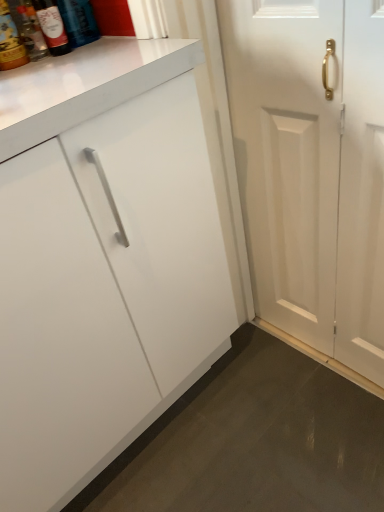
How much space does matte glass bottle at upper left, which is the 1th bottle in left-to-right order, occupy vertically?

The height of matte glass bottle at upper left, which is the 1th bottle in left-to-right order, is 8.98 inches.

Where is `white wooden door at right`? This screenshot has width=384, height=512. white wooden door at right is located at coordinates (312, 167).

What do you see at coordinates (78, 21) in the screenshot? This screenshot has height=512, width=384. I see `matte glass bottle at upper left, which ranks as the 4th bottle in left-to-right order` at bounding box center [78, 21].

The image size is (384, 512). In order to click on matte glass bottle at upper left, which is the 1th bottle in left-to-right order in this screenshot , I will do `click(10, 41)`.

Considering the relative sizes of matte glass bottle at upper left, arranged as the 2th bottle when viewed from the left, and matte glass bottle at upper left, which is the third bottle from left to right, in the image provided, is matte glass bottle at upper left, arranged as the 2th bottle when viewed from the left, thinner than matte glass bottle at upper left, which is the third bottle from left to right,?

Incorrect, the width of matte glass bottle at upper left, arranged as the 2th bottle when viewed from the left, is not less than that of matte glass bottle at upper left, which is the third bottle from left to right.

Is matte glass bottle at upper left, the 3th bottle positioned from the right, positioned beyond the bounds of matte glass bottle at upper left, which is the third bottle from left to right?

That's correct, matte glass bottle at upper left, the 3th bottle positioned from the right, is outside of matte glass bottle at upper left, which is the third bottle from left to right.

From a real-world perspective, which object rests below the other?

matte glass bottle at upper left, the 3th bottle positioned from the right, from a real-world perspective.

Which is closer to the camera, (67, 25) or (49, 9)?

Point (67, 25) appears to be farther away from the viewer than point (49, 9).

Which bottle is the 4th one when counting from the back of the white wooden door at right? Please provide its 2D coordinates.

[(64, 24)]

Is white wooden door at right next to matte glass bottle at upper left, the 3th bottle positioned from the right, and touching it?

white wooden door at right and matte glass bottle at upper left, the 3th bottle positioned from the right, are clearly separated.

How different are the orientations of white wooden door at right and matte glass bottle at upper left, arranged as the 2th bottle when viewed from the left, in degrees?

They differ by 90 degrees in their facing directions.

Considering the relative sizes of white wooden door at right and matte glass bottle at upper left, the 3th bottle positioned from the right, in the image provided, is white wooden door at right thinner than matte glass bottle at upper left, the 3th bottle positioned from the right,?

Yes, white wooden door at right is thinner than matte glass bottle at upper left, the 3th bottle positioned from the right.

From a real-world perspective, which object stands above the other?

matte glass bottle at upper left, which is the 1th bottle in left-to-right order, from a real-world perspective.

Which is nearer, (59,14) or (14,32)?

The point (59,14) is closer to the camera.

Is matte glass bottle at upper left, which is the third bottle from left to right, located outside matte glass bottle at upper left, which is the 1th bottle in left-to-right order?

That's correct, matte glass bottle at upper left, which is the third bottle from left to right, is outside of matte glass bottle at upper left, which is the 1th bottle in left-to-right order.

From the image's perspective, which is below, matte glass bottle at upper left, placed as the fourth bottle when sorted from right to left, or matte glass bottle at upper left, arranged as the 2th bottle when viewed from the left?

From the image's view, matte glass bottle at upper left, placed as the fourth bottle when sorted from right to left, is below.

From the picture: Is matte glass bottle at upper left, placed as the fourth bottle when sorted from right to left, to the left or to the right of matte glass bottle at upper left, arranged as the 2th bottle when viewed from the left, in the image?

Based on their positions, matte glass bottle at upper left, placed as the fourth bottle when sorted from right to left, is located to the left of matte glass bottle at upper left, arranged as the 2th bottle when viewed from the left.

From a real-world perspective, is matte glass bottle at upper left, which is the 1th bottle in left-to-right order, physically below matte glass bottle at upper left, arranged as the 2th bottle when viewed from the left?

No, from a real-world perspective, matte glass bottle at upper left, which is the 1th bottle in left-to-right order, is not under matte glass bottle at upper left, arranged as the 2th bottle when viewed from the left.

Is matte glass bottle at upper left, placed as the fourth bottle when sorted from right to left, further to camera compared to matte glass bottle at upper left, arranged as the 2th bottle when viewed from the left?

No, matte glass bottle at upper left, placed as the fourth bottle when sorted from right to left, is in front of matte glass bottle at upper left, arranged as the 2th bottle when viewed from the left.

What's the angular difference between matte glass bottle at upper left, placed as the fourth bottle when sorted from right to left, and matte glass bottle at upper left, which ranks as the 1th bottle in right-to-left order,'s facing directions?

There is a 0.00418-degree angle between the facing directions of matte glass bottle at upper left, placed as the fourth bottle when sorted from right to left, and matte glass bottle at upper left, which ranks as the 1th bottle in right-to-left order.

Does point (5, 3) come behind point (63, 11)?

Yes, point (5, 3) is behind point (63, 11).

Is matte glass bottle at upper left, placed as the fourth bottle when sorted from right to left, at the right side of matte glass bottle at upper left, which ranks as the 1th bottle in right-to-left order?

In fact, matte glass bottle at upper left, placed as the fourth bottle when sorted from right to left, is to the left of matte glass bottle at upper left, which ranks as the 1th bottle in right-to-left order.

From the image's perspective, does matte glass bottle at upper left, placed as the fourth bottle when sorted from right to left, appear higher than matte glass bottle at upper left, which ranks as the 1th bottle in right-to-left order?

Incorrect, from the image's perspective, matte glass bottle at upper left, placed as the fourth bottle when sorted from right to left, is lower than matte glass bottle at upper left, which ranks as the 1th bottle in right-to-left order.

Based on the photo, considering the relative positions of matte glass bottle at upper left, which ranks as the 1th bottle in right-to-left order, and matte glass bottle at upper left, placed as the fourth bottle when sorted from right to left, in the image provided, is matte glass bottle at upper left, which ranks as the 1th bottle in right-to-left order, behind matte glass bottle at upper left, placed as the fourth bottle when sorted from right to left,?

Yes, it is behind matte glass bottle at upper left, placed as the fourth bottle when sorted from right to left.

Does matte glass bottle at upper left, which ranks as the 4th bottle in left-to-right order, have a smaller size compared to matte glass bottle at upper left, placed as the fourth bottle when sorted from right to left?

Incorrect, matte glass bottle at upper left, which ranks as the 4th bottle in left-to-right order, is not smaller in size than matte glass bottle at upper left, placed as the fourth bottle when sorted from right to left.

Considering the relative sizes of matte glass bottle at upper left, which ranks as the 4th bottle in left-to-right order, and matte glass bottle at upper left, placed as the fourth bottle when sorted from right to left, in the image provided, is matte glass bottle at upper left, which ranks as the 4th bottle in left-to-right order, shorter than matte glass bottle at upper left, placed as the fourth bottle when sorted from right to left,?

In fact, matte glass bottle at upper left, which ranks as the 4th bottle in left-to-right order, may be taller than matte glass bottle at upper left, placed as the fourth bottle when sorted from right to left.

Based on the photo, how far apart are matte glass bottle at upper left, which ranks as the 1th bottle in right-to-left order, and matte glass bottle at upper left, which is the 1th bottle in left-to-right order?

matte glass bottle at upper left, which ranks as the 1th bottle in right-to-left order, is 5.05 inches from matte glass bottle at upper left, which is the 1th bottle in left-to-right order.

From the picture: Considering the relative sizes of matte glass bottle at upper left, the 3th bottle positioned from the right, and white wooden door at right in the image provided, is matte glass bottle at upper left, the 3th bottle positioned from the right, shorter than white wooden door at right?

Indeed, matte glass bottle at upper left, the 3th bottle positioned from the right, has a lesser height compared to white wooden door at right.

Is matte glass bottle at upper left, arranged as the 2th bottle when viewed from the left, looking in the opposite direction of white wooden door at right?

No, white wooden door at right is not at the back of matte glass bottle at upper left, arranged as the 2th bottle when viewed from the left.

From a real-world perspective, which is physically below, matte glass bottle at upper left, the 3th bottle positioned from the right, or white wooden door at right?

From a 3D spatial view, white wooden door at right is below.

At what (x,y) coordinates should I click in order to perform the action: click on the 1st bottle counting from the left side of the matte glass bottle at upper left, which appears as the second bottle when viewed from the right. Please return your answer as a coordinate pair (x, y). Looking at the image, I should click on (64, 24).

Locate an element on the screen. This screenshot has height=512, width=384. the 3rd bottle above the white wooden door at right (from the image's perspective) is located at coordinates (64, 24).

When comparing their distances from white wooden door at right, does matte glass bottle at upper left, which appears as the second bottle when viewed from the right, or matte glass bottle at upper left, which ranks as the 4th bottle in left-to-right order, seem further?

Among the two, matte glass bottle at upper left, which appears as the second bottle when viewed from the right, is located further to white wooden door at right.

Estimate the real-world distances between objects in this image. Which object is further from matte glass bottle at upper left, which is the 1th bottle in left-to-right order, matte glass bottle at upper left, which ranks as the 1th bottle in right-to-left order, or white wooden door at right?

white wooden door at right is further to matte glass bottle at upper left, which is the 1th bottle in left-to-right order.

When comparing their distances from matte glass bottle at upper left, arranged as the 2th bottle when viewed from the left, does matte glass bottle at upper left, which ranks as the 4th bottle in left-to-right order, or matte glass bottle at upper left, which appears as the second bottle when viewed from the right, seem further?

Among the two, matte glass bottle at upper left, which appears as the second bottle when viewed from the right, is located further to matte glass bottle at upper left, arranged as the 2th bottle when viewed from the left.

From the image, which object appears to be farther from matte glass bottle at upper left, placed as the fourth bottle when sorted from right to left, matte glass bottle at upper left, arranged as the 2th bottle when viewed from the left, or white wooden door at right?

Among the two, white wooden door at right is located further to matte glass bottle at upper left, placed as the fourth bottle when sorted from right to left.

From the image, which object appears to be farther from matte glass bottle at upper left, placed as the fourth bottle when sorted from right to left, matte glass bottle at upper left, which is the third bottle from left to right, or matte glass bottle at upper left, which ranks as the 1th bottle in right-to-left order?

matte glass bottle at upper left, which ranks as the 1th bottle in right-to-left order, is further to matte glass bottle at upper left, placed as the fourth bottle when sorted from right to left.

Looking at the image, which one is located further to matte glass bottle at upper left, which ranks as the 1th bottle in right-to-left order, matte glass bottle at upper left, the 3th bottle positioned from the right, or matte glass bottle at upper left, which is the third bottle from left to right?

Among the two, matte glass bottle at upper left, which is the third bottle from left to right, is located further to matte glass bottle at upper left, which ranks as the 1th bottle in right-to-left order.

Looking at the image, which one is located closer to matte glass bottle at upper left, placed as the fourth bottle when sorted from right to left, matte glass bottle at upper left, arranged as the 2th bottle when viewed from the left, or matte glass bottle at upper left, which appears as the second bottle when viewed from the right?

matte glass bottle at upper left, which appears as the second bottle when viewed from the right, lies closer to matte glass bottle at upper left, placed as the fourth bottle when sorted from right to left, than the other object.

Looking at the image, which one is located further to matte glass bottle at upper left, which appears as the second bottle when viewed from the right, matte glass bottle at upper left, arranged as the 2th bottle when viewed from the left, or matte glass bottle at upper left, which ranks as the 4th bottle in left-to-right order?

matte glass bottle at upper left, which ranks as the 4th bottle in left-to-right order, lies further to matte glass bottle at upper left, which appears as the second bottle when viewed from the right, than the other object.

I want to click on bottle situated between matte glass bottle at upper left, which is the third bottle from left to right, and white wooden door at right from left to right, so click(x=78, y=21).

I want to click on bottle between matte glass bottle at upper left, which ranks as the 1th bottle in right-to-left order, and matte glass bottle at upper left, which appears as the second bottle when viewed from the right, vertically, so click(64, 24).

You are a GUI agent. You are given a task and a screenshot of the screen. Output one action in this format:
    pyautogui.click(x=<x>, y=<y>)
    Task: Click on the bottle between matte glass bottle at upper left, which is the 1th bottle in left-to-right order, and matte glass bottle at upper left, which is the third bottle from left to right, from left to right
    
    Given the screenshot: What is the action you would take?
    [64, 24]